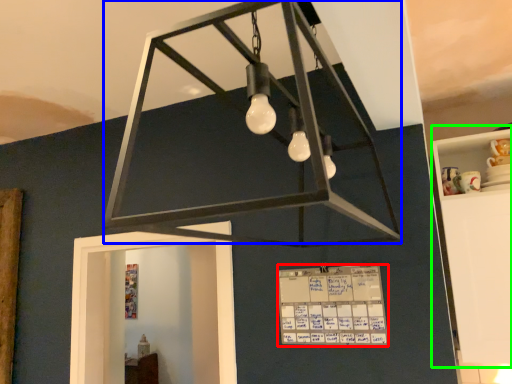
Question: Which object is positioned closest to writing (highlighted by a red box)? Select from lamp (highlighted by a blue box) and furniture (highlighted by a green box).

Choices:
 (A) lamp
 (B) furniture

Answer: (A)